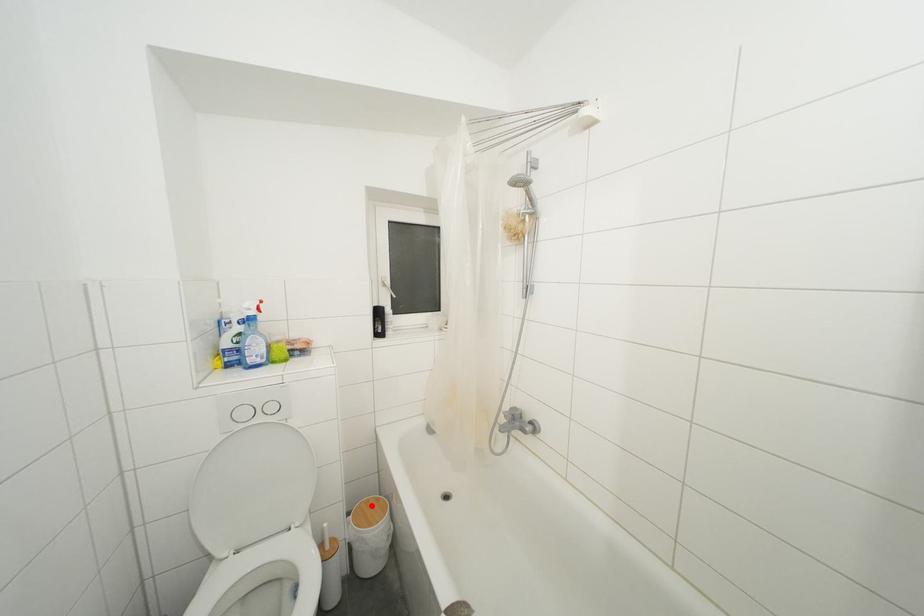
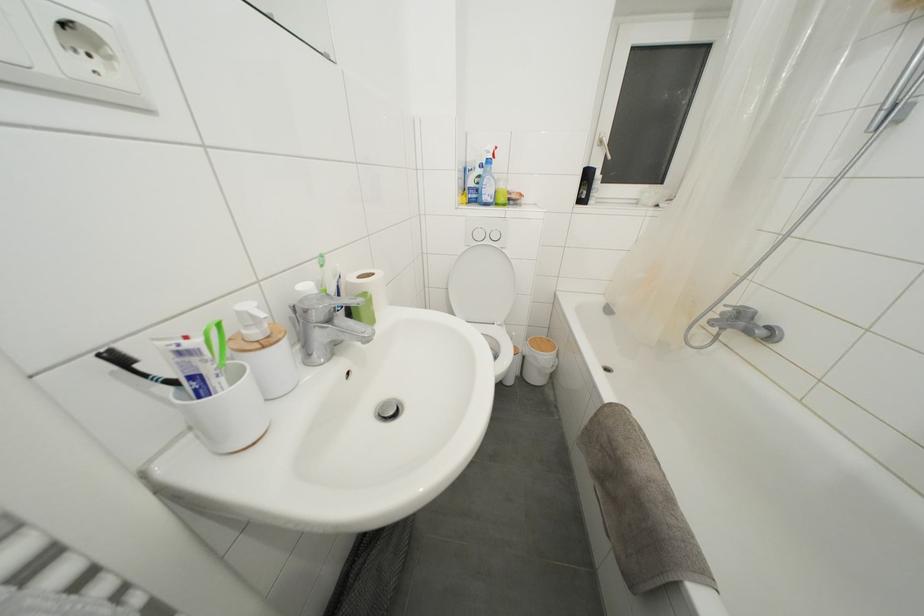
Question: I am providing you with two images of the same scene from different viewpoints. A red point is marked on the first image. At the location where the point appears in image 1, is it still visible in image 2?

Choices:
 (A) Yes
 (B) No

Answer: (A)